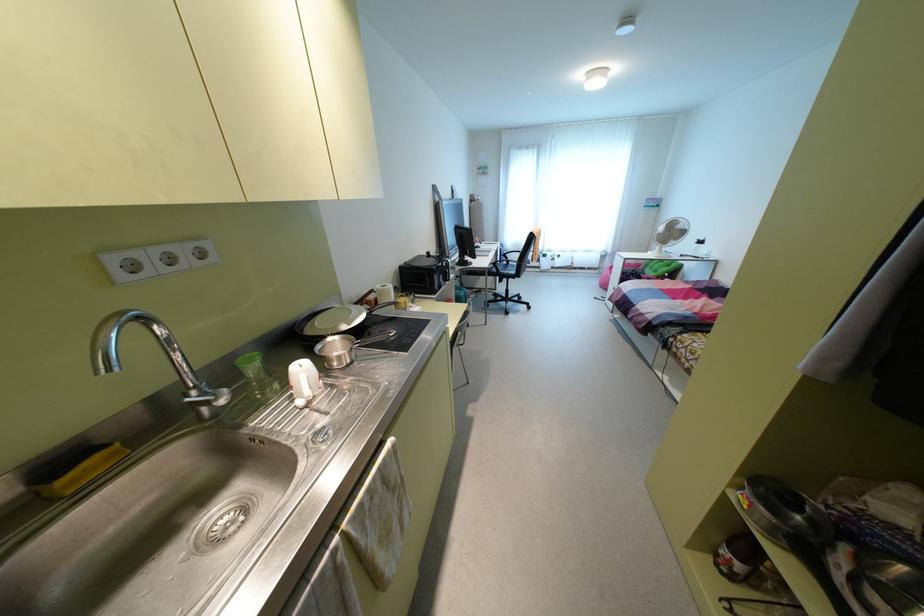
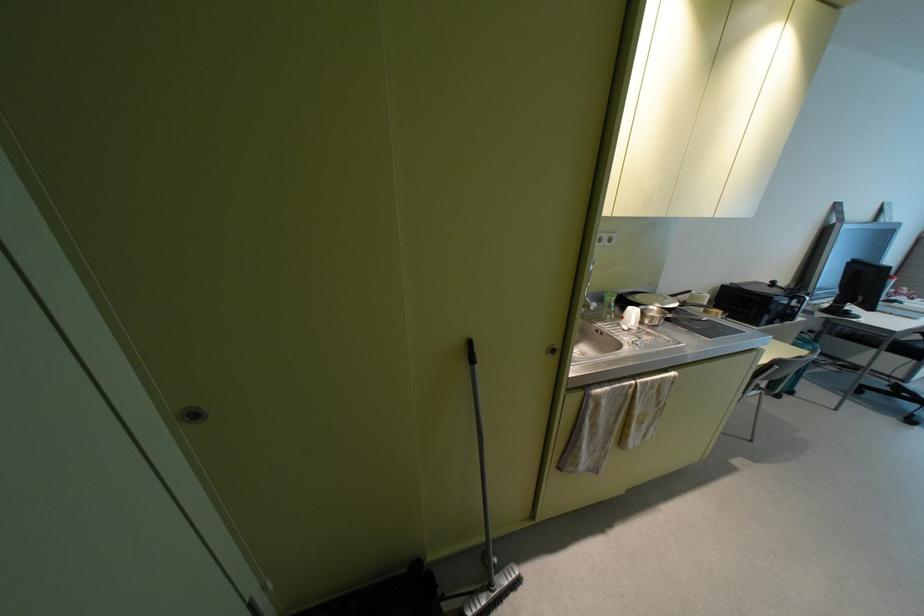
Question: The camera is either moving clockwise (left) or counter-clockwise (right) around the object. The first image is from the beginning of the video and the second image is from the end. Is the camera moving left or right when shooting the video?

Choices:
 (A) Left
 (B) Right

Answer: (B)